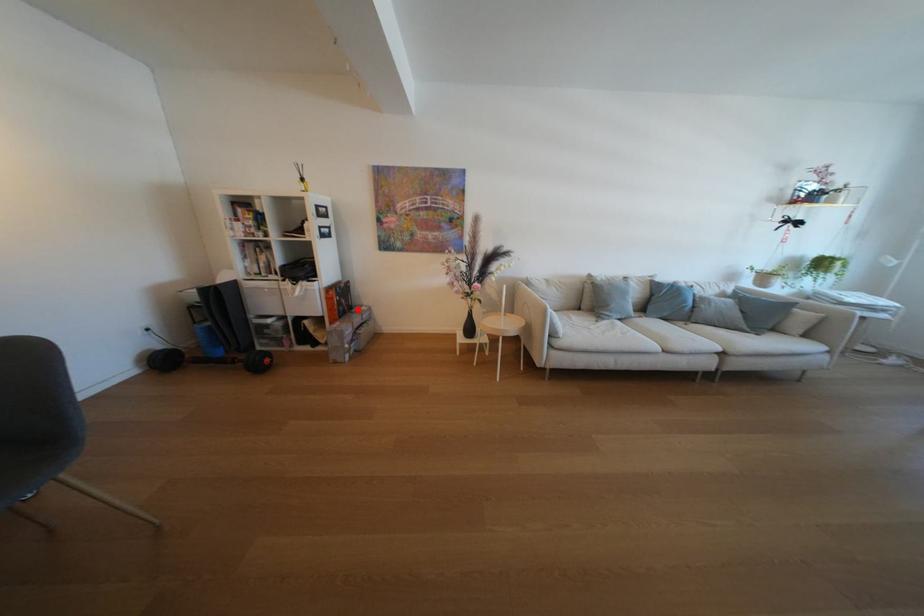
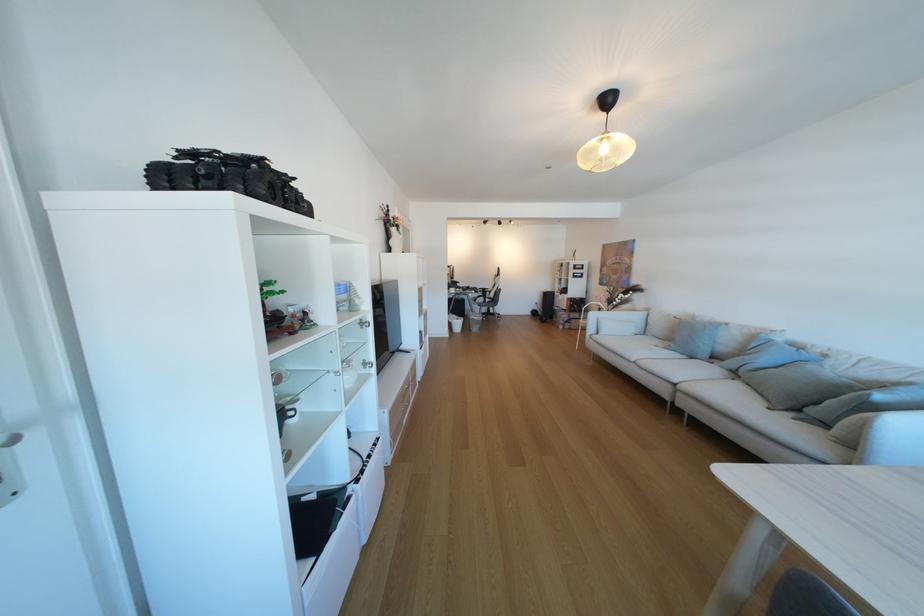
Question: I am providing you with two images of the same scene from different viewpoints. A red point is marked on the first image. At the location where the point appears in image 1, is it still visible in image 2?

Choices:
 (A) Yes
 (B) No

Answer: (A)